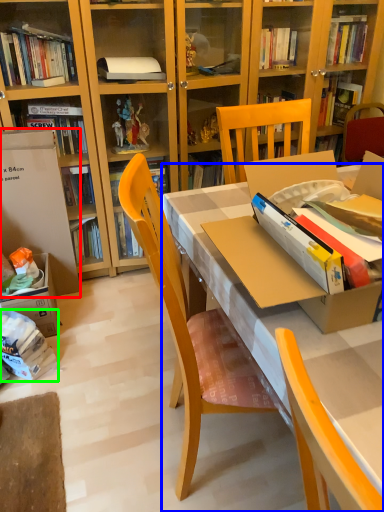
Question: Which is nearer to the leftover (highlighted by a red box)? desk (highlighted by a blue box) or book (highlighted by a green box).

Choices:
 (A) desk
 (B) book

Answer: (B)